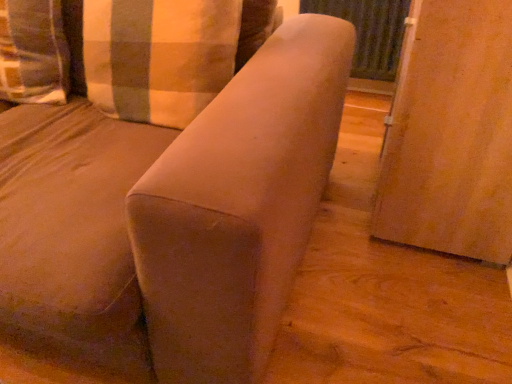
Question: In the image, is wooden screen door at right, which is counted as the 1th screen door, starting from the front, positioned in front of or behind matte black radiator at upper right, which is counted as the second screen door, starting from the front?

Choices:
 (A) front
 (B) behind

Answer: (A)

Question: From a real-world perspective, relative to matte black radiator at upper right, the first screen door viewed from the back, is wooden screen door at right, which is counted as the 2th screen door, starting from the back, vertically above or below?

Choices:
 (A) below
 (B) above

Answer: (B)

Question: Which object is positioned farthest from the wooden screen door at right, which is counted as the 2th screen door, starting from the back?

Choices:
 (A) matte black radiator at upper right, which is counted as the second screen door, starting from the front
 (B) plaid fabric pillow at upper left, the first pillow viewed from the right
 (C) plaid fabric pillow at upper left, which is the second pillow in right-to-left order
 (D) suede-like beige sofa at center

Answer: (C)

Question: Based on their relative distances, which object is farther from the suede-like beige sofa at center?

Choices:
 (A) plaid fabric pillow at upper left, placed as the first pillow when sorted from left to right
 (B) plaid fabric pillow at upper left, the first pillow viewed from the right
 (C) wooden screen door at right, which is counted as the 1th screen door, starting from the front
 (D) matte black radiator at upper right, the first screen door viewed from the back

Answer: (D)